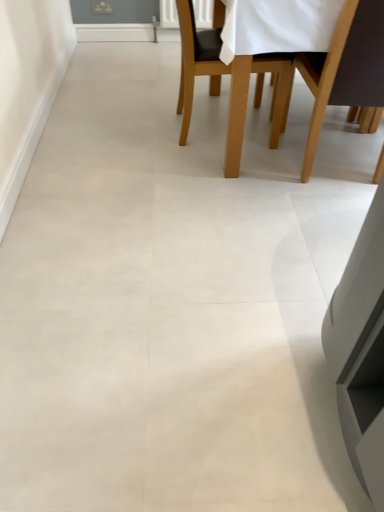
At what (x,y) coordinates should I click in order to perform the action: click on free space that is in between brown wood chair at upper right, the first chair positioned from the right, and light brown wooden chair at upper center, which appears as the 1th chair when viewed from the left. Please return your answer as a coordinate pair (x, y). This screenshot has height=512, width=384. Looking at the image, I should click on (274, 149).